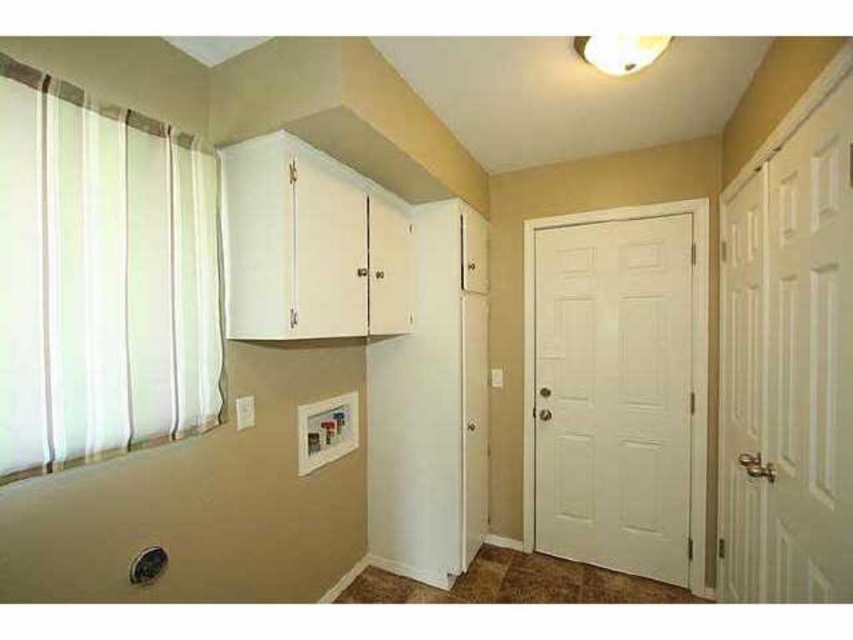
You are standing in the utility room and need to determine which object is smaller between the white sheer curtain at left and the white matte door at right. Can you identify the smaller one?

The white sheer curtain at left is smaller compared to the white matte door at right, so the smaller object is the white sheer curtain at left.

Where is the white sheer curtain at left located in the room?

The white sheer curtain at left is located at point [102,276] in the room.

You are standing in the utility room and want to open the window to let some fresh air in. The window is behind the white sheer curtain at left. Can you reach the window if you are 1.6 meters tall and can reach up to 1.8 meters?

The white sheer curtain at left is 1.31 meters away from the viewer. Since you can reach up to 1.8 meters, you can comfortably reach the window behind the white sheer curtain at left as the distance is within your reach range.